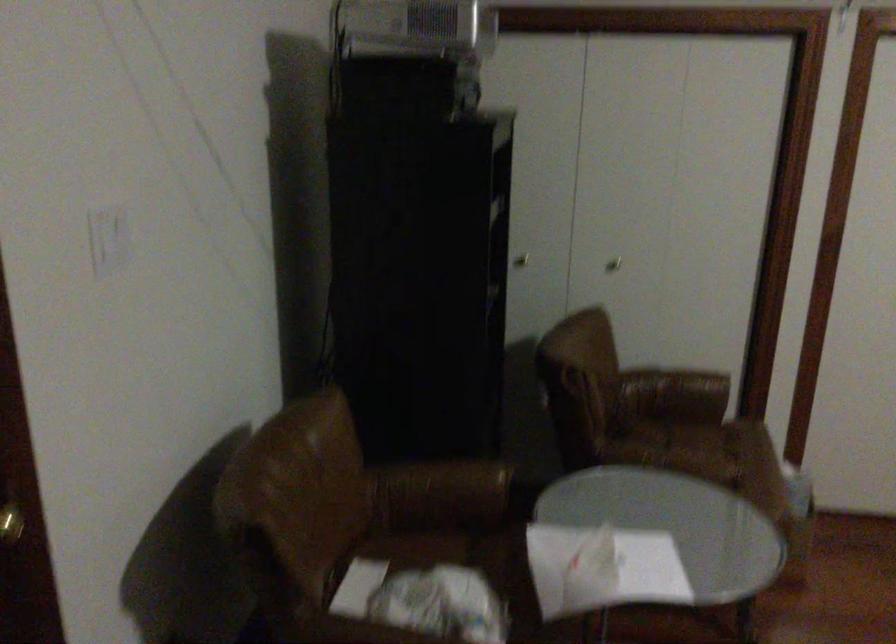
The image size is (896, 644). I want to click on chair armrest, so click(442, 488).